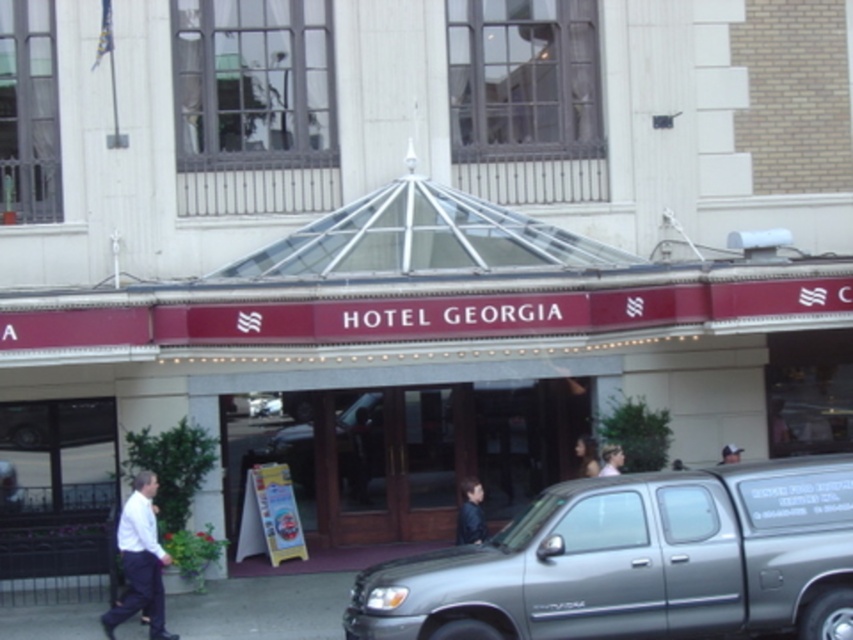
What do you see at coordinates (585, 456) in the screenshot?
I see `smooth brown hair at center` at bounding box center [585, 456].

Does smooth brown hair at center appear over light brown hair at center?

No, smooth brown hair at center is not above light brown hair at center.

Is point (585, 440) less distant than point (607, 472)?

No.

Find the location of a particular element. smooth brown hair at center is located at coordinates pyautogui.click(x=585, y=456).

In the scene shown: Between silver metallic minivan at center and white smooth shirt at lower left, which one has more height?

white smooth shirt at lower left is taller.

Who is lower down, silver metallic minivan at center or white smooth shirt at lower left?

white smooth shirt at lower left is lower down.

Find the location of a particular element. silver metallic minivan at center is located at coordinates (637, 561).

What do you see at coordinates (422, 362) in the screenshot? I see `maroon signboard at center` at bounding box center [422, 362].

Which is behind, point (657, 346) or point (460, 536)?

The point (657, 346) is behind.

Where is `maroon signboard at center`? The height and width of the screenshot is (640, 853). maroon signboard at center is located at coordinates (422, 362).